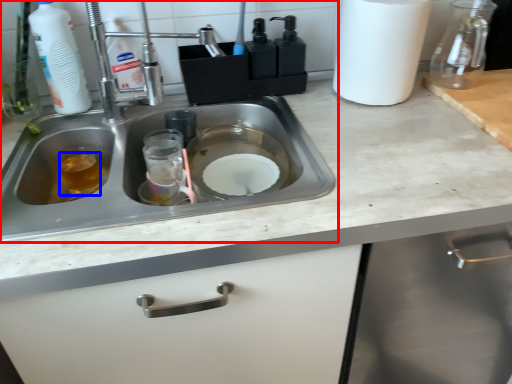
Question: Which object appears farthest to the camera in this image, sink (highlighted by a red box) or liquid (highlighted by a blue box)?

Choices:
 (A) sink
 (B) liquid

Answer: (B)